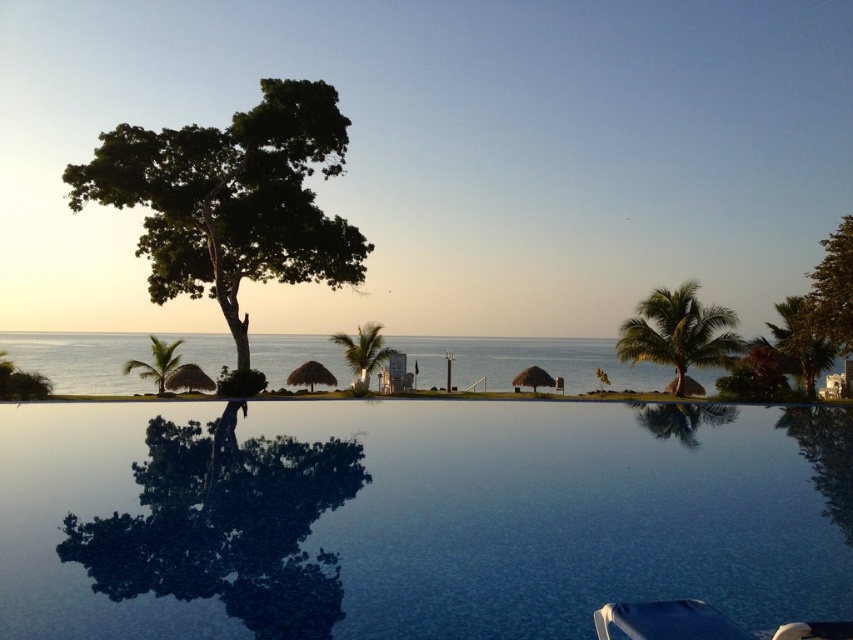
You are standing at the edge of the infinity pool and want to determine which of the two palm trees, the green leafy palm tree at right or the green leafy palm tree at center, is taller. Based on the scene description, which one is taller?

The green leafy palm tree at right is taller than the green leafy palm tree at center according to the description.

You are standing at the edge of the infinity pool and want to look at two points in the image. Which point, point (598, 616) or point (392, 352), is closer to you?

Point (598, 616) is closer to you than point (392, 352).